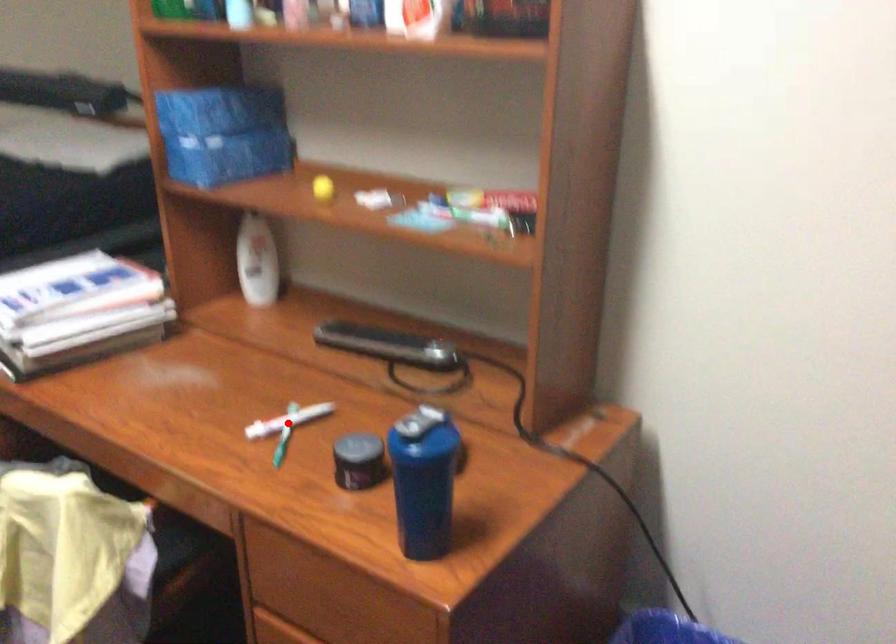
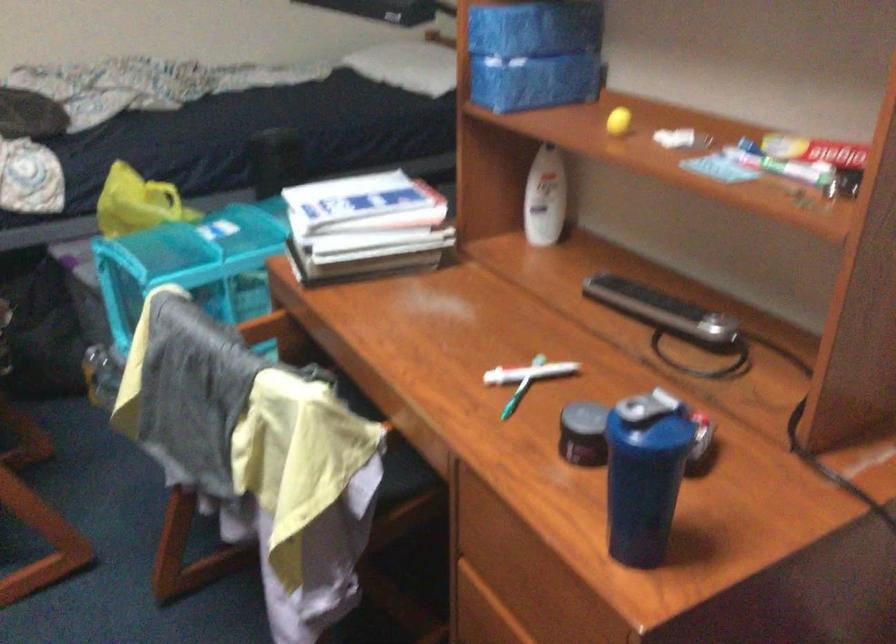
Locate, in the second image, the point that corresponds to the highlighted location in the first image.

(529, 373)